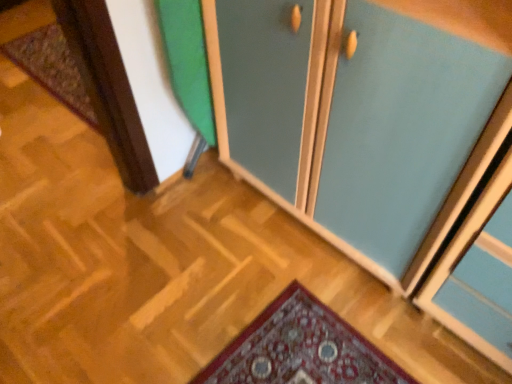
Question: Is carpeted mat at left bigger or smaller than teal matte cabinet at center?

Choices:
 (A) small
 (B) big

Answer: (A)

Question: In terms of width, does carpeted mat at left look wider or thinner when compared to teal matte cabinet at center?

Choices:
 (A) wide
 (B) thin

Answer: (B)

Question: From a real-world perspective, is carpeted mat at left physically located above or below teal matte cabinet at center?

Choices:
 (A) above
 (B) below

Answer: (B)

Question: From a real-world perspective, relative to carpeted mat at left, is teal matte cabinet at center vertically above or below?

Choices:
 (A) below
 (B) above

Answer: (B)

Question: Considering the positions of teal matte cabinet at center and carpeted mat at left in the image, is teal matte cabinet at center bigger or smaller than carpeted mat at left?

Choices:
 (A) big
 (B) small

Answer: (A)

Question: Considering the positions of teal matte cabinet at center and carpeted mat at left in the image, is teal matte cabinet at center taller or shorter than carpeted mat at left?

Choices:
 (A) tall
 (B) short

Answer: (A)

Question: Looking at their shapes, would you say teal matte cabinet at center is wider or thinner than carpeted mat at left?

Choices:
 (A) thin
 (B) wide

Answer: (B)